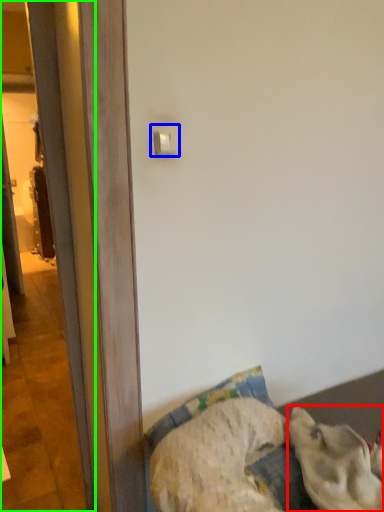
Question: Considering the real-world distances, which object is closest to animal (highlighted by a red box)? light switch (highlighted by a blue box) or screen door (highlighted by a green box).

Choices:
 (A) light switch
 (B) screen door

Answer: (B)